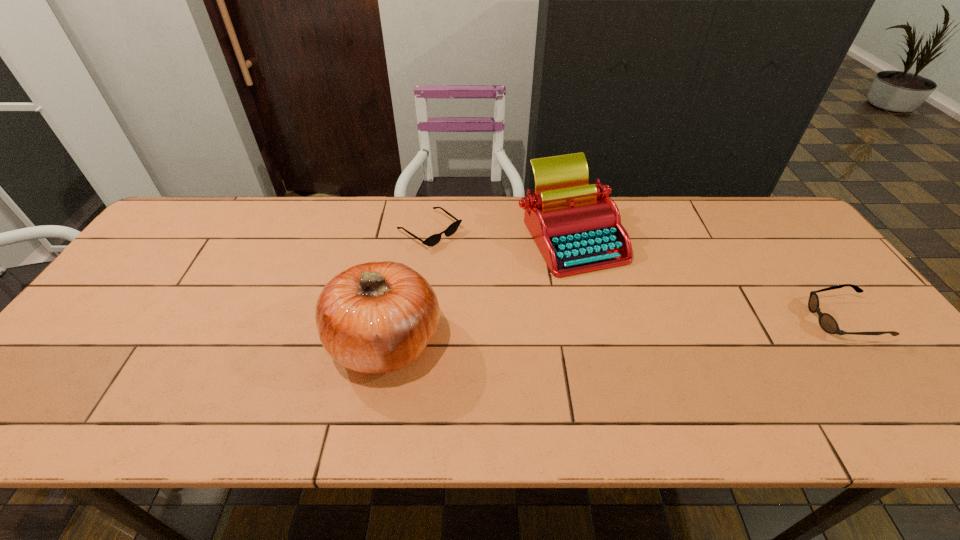
Find the location of a particular element. The width and height of the screenshot is (960, 540). vacant area that lies between the nearer sunglasses and the shortest object is located at coordinates (636, 275).

This screenshot has width=960, height=540. Find the location of `vacant space that is in between the typewriter and the taller sunglasses`. vacant space that is in between the typewriter and the taller sunglasses is located at coordinates (707, 277).

Find the location of a particular element. empty space that is in between the right sunglasses and the left sunglasses is located at coordinates (636, 275).

Find the location of a particular element. empty space between the right sunglasses and the tallest object is located at coordinates (614, 329).

At what (x,y) coordinates should I click in order to perform the action: click on vacant region between the left sunglasses and the third object from left to right. Please return your answer as a coordinate pair (x, y). The image size is (960, 540). Looking at the image, I should click on (500, 233).

The height and width of the screenshot is (540, 960). Find the location of `object that stands as the closest to the third shortest object`. object that stands as the closest to the third shortest object is located at coordinates (x=434, y=239).

This screenshot has width=960, height=540. In order to click on the second closest object to the typewriter in this screenshot , I will do `click(376, 317)`.

Where is `free space that satisfies the following two spatial constraints: 1. on the front side of the taller sunglasses; 2. on the lenses of the shortest object`? The image size is (960, 540). free space that satisfies the following two spatial constraints: 1. on the front side of the taller sunglasses; 2. on the lenses of the shortest object is located at coordinates (419, 320).

Image resolution: width=960 pixels, height=540 pixels. Identify the location of free space that satisfies the following two spatial constraints: 1. on the front side of the shortest object; 2. on the lenses of the rightmost object. (419, 320).

Identify the location of vacant space that satisfies the following two spatial constraints: 1. on the front side of the shorter sunglasses; 2. on the right side of the typewriter. (429, 235).